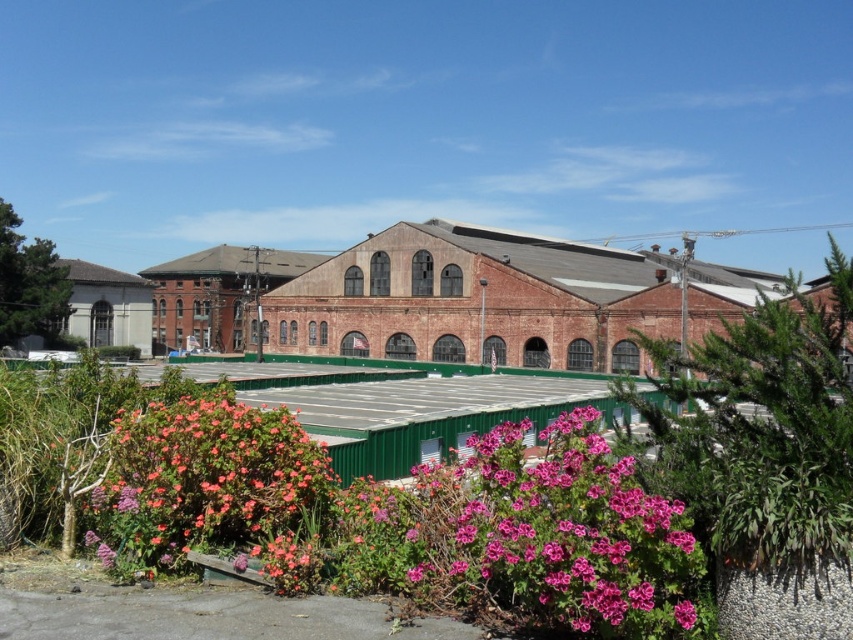
You are standing at the point with coordinates point (689, 609) and want to walk towards the point with coordinates point (315, 554). According to the scene, will you be moving towards the foreground or the background?

Since point (315, 554) is behind point (689, 609), moving towards it would mean moving towards the background.

You are standing at the entrance of the industrial complex and notice the pink matte flower at lower center. Based on its coordinates, which direction should you walk to reach it from your current position?

Answer: The pink matte flower at lower center is located at coordinates point (288, 564). Since the x and y coordinates are both relatively high, you should walk towards the lower center direction to reach it.

You are a photographer standing at the camera position in the scene. You want to capture a closeup shot of the pink matte flower at lower left. Given that your camera can focus on objects within 25 meters, will you be able to take the photo without moving closer?

The pink matte flower at lower left is 27.59 meters away from camera, which is beyond the camera focus range of 25 meters. You will need to move closer to take the photo.